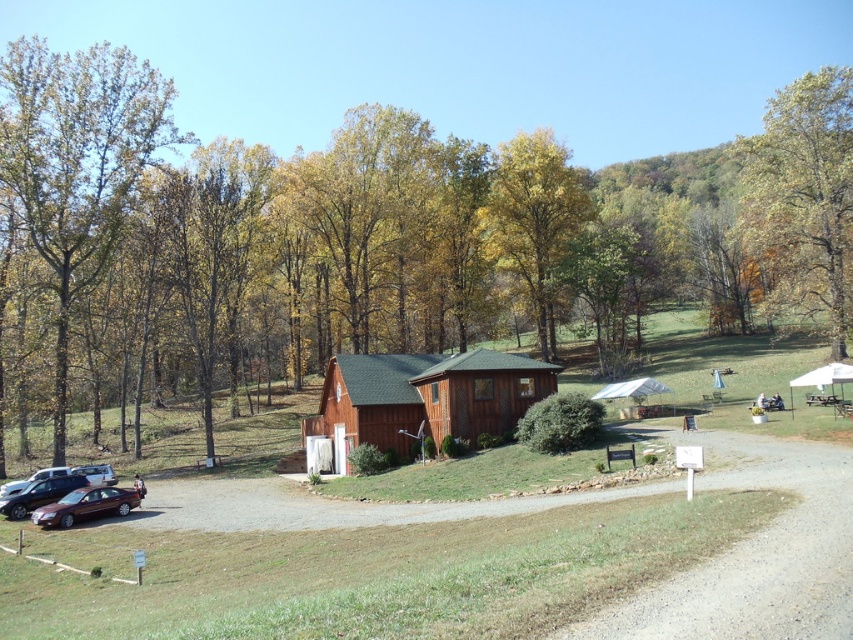
Does wooden cabin at center appear under satin brown sedan at lower left?

No.

Between wooden cabin at center and satin brown sedan at lower left, which one appears on the right side from the viewer's perspective?

wooden cabin at center

Who is more forward, (526,556) or (47,516)?

Point (526,556)

Identify the location of wooden cabin at center. The width and height of the screenshot is (853, 640). [463, 563].

Between point (630, 195) and point (502, 163), which one is positioned behind?

The point (630, 195) is behind.

Who is shorter, brown wood cabin at center or yellow-green leaves at center?

yellow-green leaves at center

What are the coordinates of `brown wood cabin at center` in the screenshot? It's located at (367, 241).

The width and height of the screenshot is (853, 640). I want to click on brown wood cabin at center, so click(x=367, y=241).

Identify the location of yellow-green leaves at upper right. (804, 196).

In the scene shown: Between yellow-green leaves at upper right and brown wooden hut at center, which one appears on the right side from the viewer's perspective?

yellow-green leaves at upper right is more to the right.

The image size is (853, 640). Find the location of `yellow-green leaves at upper right`. yellow-green leaves at upper right is located at coordinates (804, 196).